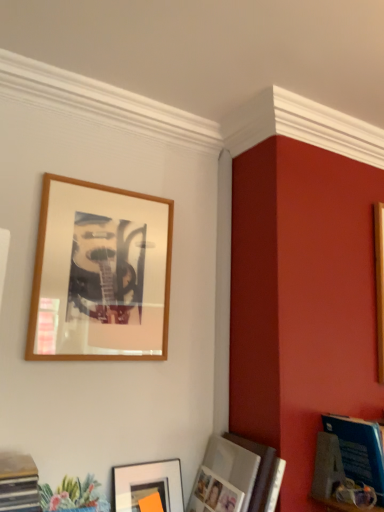
Question: Should I look upward or downward to see matte silver photo frame at lower right, which ranks as the 2th picture frame in bottom-to-top order?

Choices:
 (A) down
 (B) up

Answer: (A)

Question: Does wooden frame at upper left, arranged as the 3th picture frame when ordered from the bottom, have a larger size compared to blue glossy magazine at lower right?

Choices:
 (A) no
 (B) yes

Answer: (A)

Question: From the image's perspective, does wooden frame at upper left, positioned as the first picture frame in top-to-bottom order, appear lower than blue glossy magazine at lower right?

Choices:
 (A) yes
 (B) no

Answer: (B)

Question: Can you confirm if wooden frame at upper left, arranged as the 3th picture frame when ordered from the bottom, is shorter than blue glossy magazine at lower right?

Choices:
 (A) yes
 (B) no

Answer: (B)

Question: Is wooden frame at upper left, arranged as the 3th picture frame when ordered from the bottom, to the right of blue glossy magazine at lower right from the viewer's perspective?

Choices:
 (A) yes
 (B) no

Answer: (B)

Question: Is wooden frame at upper left, arranged as the 3th picture frame when ordered from the bottom, taller than blue glossy magazine at lower right?

Choices:
 (A) no
 (B) yes

Answer: (B)

Question: From a real-world perspective, is wooden frame at upper left, positioned as the first picture frame in top-to-bottom order, located beneath blue glossy magazine at lower right?

Choices:
 (A) yes
 (B) no

Answer: (B)

Question: Is blue glossy magazine at lower right far away from matte black picture frame at lower center, which is counted as the third picture frame, starting from the top?

Choices:
 (A) yes
 (B) no

Answer: (B)

Question: Is blue glossy magazine at lower right wider than matte black picture frame at lower center, which appears as the 1th picture frame when ordered from the bottom?

Choices:
 (A) yes
 (B) no

Answer: (A)

Question: From the image's perspective, does blue glossy magazine at lower right appear higher than matte black picture frame at lower center, which appears as the 1th picture frame when ordered from the bottom?

Choices:
 (A) yes
 (B) no

Answer: (A)

Question: From the image's perspective, does blue glossy magazine at lower right appear lower than matte black picture frame at lower center, which is counted as the third picture frame, starting from the top?

Choices:
 (A) yes
 (B) no

Answer: (B)

Question: Can you confirm if blue glossy magazine at lower right is positioned to the left of matte black picture frame at lower center, which is counted as the third picture frame, starting from the top?

Choices:
 (A) no
 (B) yes

Answer: (A)

Question: Can you confirm if blue glossy magazine at lower right is positioned to the right of matte black picture frame at lower center, which appears as the 1th picture frame when ordered from the bottom?

Choices:
 (A) yes
 (B) no

Answer: (A)

Question: Considering the relative sizes of matte black picture frame at lower center, which is counted as the third picture frame, starting from the top, and blue glossy magazine at lower right in the image provided, is matte black picture frame at lower center, which is counted as the third picture frame, starting from the top, bigger than blue glossy magazine at lower right?

Choices:
 (A) no
 (B) yes

Answer: (A)